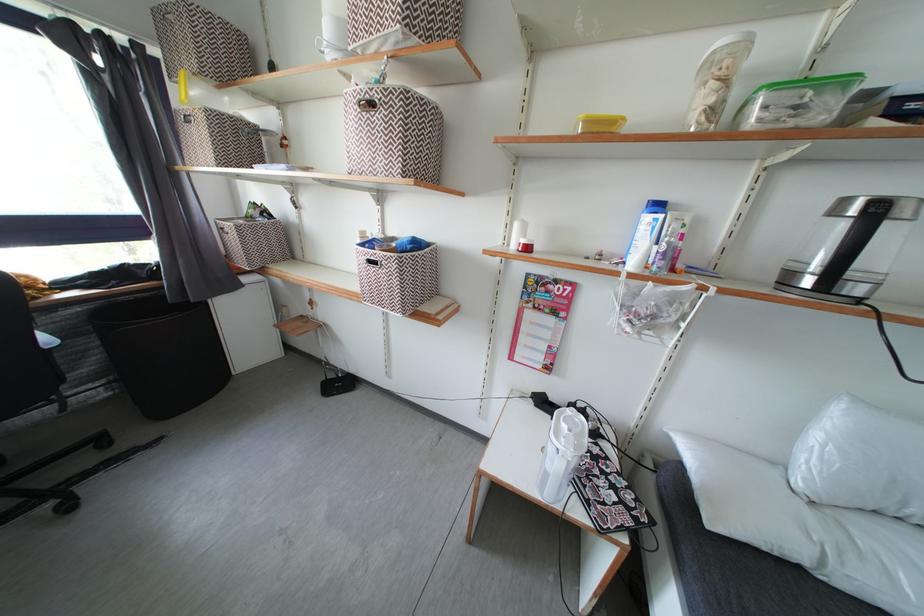
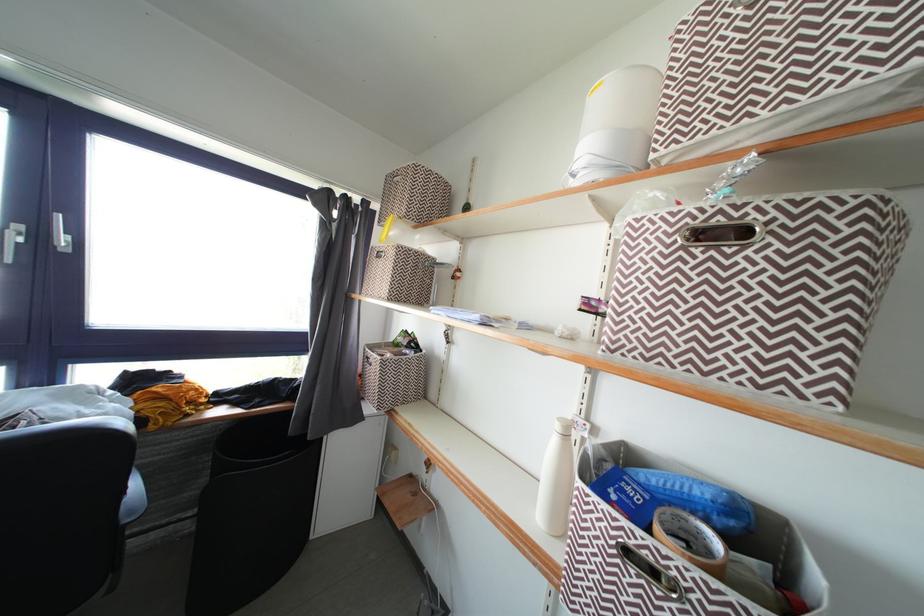
Based on the continuous images, in which direction is the camera rotating?

The camera's rotation is toward left-up.